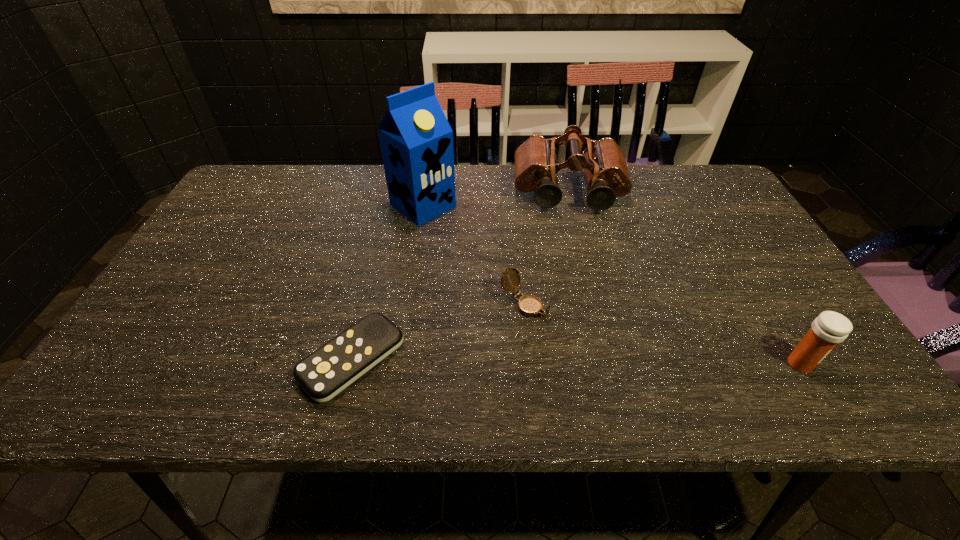
Find the location of `medicine at the near edge`. medicine at the near edge is located at coordinates (827, 330).

The image size is (960, 540). I want to click on object at the right edge, so click(827, 330).

Where is `object at the near right corner`? The image size is (960, 540). object at the near right corner is located at coordinates (827, 330).

Identify the location of blank space at the far edge. (344, 185).

You are a GUI agent. You are given a task and a screenshot of the screen. Output one action in this format:
    pyautogui.click(x=<x>, y=<y>)
    Task: Click on the vacant region at the left edge of the desktop
    This screenshot has width=960, height=540.
    Given the screenshot: What is the action you would take?
    pyautogui.click(x=195, y=325)

Find the location of a particular element. This screenshot has height=540, width=960. vacant space at the far left corner of the desktop is located at coordinates (269, 194).

You are a GUI agent. You are given a task and a screenshot of the screen. Output one action in this format:
    pyautogui.click(x=<x>, y=<y>)
    Task: Click on the vacant space at the near left corner
    The height and width of the screenshot is (540, 960).
    Given the screenshot: What is the action you would take?
    [x=190, y=332]

The width and height of the screenshot is (960, 540). What are the coordinates of `vacant space that's between the binoculars and the carton` in the screenshot? It's located at (496, 199).

Where is `free area in between the second shortest object and the binoculars`? The height and width of the screenshot is (540, 960). free area in between the second shortest object and the binoculars is located at coordinates point(547,248).

Find the location of a particular element. free space that is in between the remote control and the fourth shortest object is located at coordinates (461, 276).